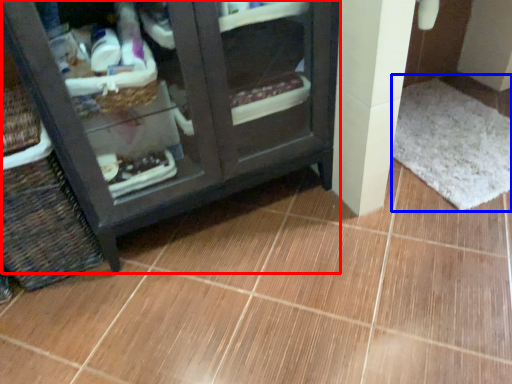
Question: Among these objects, which one is nearest to the camera, furniture (highlighted by a red box) or bath mat (highlighted by a blue box)?

Choices:
 (A) furniture
 (B) bath mat

Answer: (A)